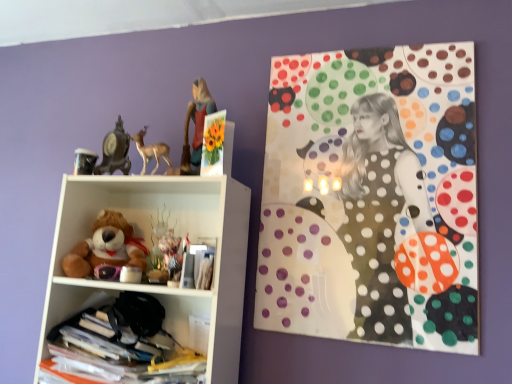
The width and height of the screenshot is (512, 384). What are the coordinates of `translucent glass vase at upper center, the 1th toy ordered from the bottom` in the screenshot? It's located at (170, 253).

This screenshot has width=512, height=384. Describe the element at coordinates (84, 161) in the screenshot. I see `matte black cup at upper left, placed as the third toy when sorted from right to left` at that location.

Describe the element at coordinates (115, 151) in the screenshot. I see `matte black clock at upper left, placed as the first toy when sorted from top to bottom` at that location.

I want to click on soft plush teddy bear at left, so click(x=106, y=250).

What do you see at coordinates (121, 332) in the screenshot? Image resolution: width=512 pixels, height=384 pixels. I see `translucent plastic folders at lower left, the second shelf when ordered from top to bottom` at bounding box center [121, 332].

This screenshot has width=512, height=384. Find the location of `matte plastic figurine of girl at upper center`. matte plastic figurine of girl at upper center is located at coordinates (196, 125).

Between point (197, 124) and point (80, 150), which one is positioned behind?

The point (80, 150) is farther from the camera.

Is matte plastic figurine of girl at upper center facing away from matte black cup at upper left, placed as the third toy when sorted from right to left?

No, matte black cup at upper left, placed as the third toy when sorted from right to left, is not at the back of matte plastic figurine of girl at upper center.

Is matte plastic figurine of girl at upper center directly adjacent to matte black cup at upper left, the 2th toy viewed from the top?

No, matte plastic figurine of girl at upper center is not next to matte black cup at upper left, the 2th toy viewed from the top.

How different are the orientations of matte plastic figurine of girl at upper center and matte black cup at upper left, which ranks as the 2th toy in bottom-to-top order, in degrees?

matte plastic figurine of girl at upper center and matte black cup at upper left, which ranks as the 2th toy in bottom-to-top order, are facing 20.7 degrees away from each other.

From a real-world perspective, is matte brown deer at upper left positioned under matte black cup at upper left, which ranks as the 2th toy in bottom-to-top order, based on gravity?

No.

Is matte brown deer at upper left in front of or behind matte black cup at upper left, which ranks as the 2th toy in bottom-to-top order, in the image?

In the image, matte brown deer at upper left appears in front of matte black cup at upper left, which ranks as the 2th toy in bottom-to-top order.

Considering the positions of point (143, 173) and point (75, 159), is point (143, 173) closer or farther from the camera than point (75, 159)?

Point (143, 173) is closer to the camera than point (75, 159).

Are matte brown deer at upper left and matte black cup at upper left, which ranks as the 2th toy in bottom-to-top order, located far from each other?

No.

What's the angular difference between matte brown deer at upper left and matte black clock at upper left, placed as the first toy when sorted from top to bottom,'s facing directions?

There is a 26.4-degree angle between the facing directions of matte brown deer at upper left and matte black clock at upper left, placed as the first toy when sorted from top to bottom.

Considering the points (147, 156) and (122, 152), which point is behind, point (147, 156) or point (122, 152)?

Positioned behind is point (122, 152).

Consider the image. From the image's perspective, is matte brown deer at upper left located beneath matte black clock at upper left, which is the 2th toy in left-to-right order?

Correct, matte brown deer at upper left appears lower than matte black clock at upper left, which is the 2th toy in left-to-right order, in the image.

Who is taller, matte black clock at upper left, the second toy when ordered from right to left, or matte black cup at upper left, placed as the third toy when sorted from right to left?

matte black clock at upper left, the second toy when ordered from right to left.

Is matte black clock at upper left, placed as the first toy when sorted from top to bottom, oriented towards matte black cup at upper left, placed as the 1th toy when sorted from left to right?

Yes.

From a real-world perspective, which object rests below the other?

matte black cup at upper left, the 2th toy viewed from the top, from a real-world perspective.

In the scene shown: Is matte black clock at upper left, placed as the first toy when sorted from top to bottom, to the right of matte black cup at upper left, which ranks as the 2th toy in bottom-to-top order, from the viewer's perspective?

Yes, matte black clock at upper left, placed as the first toy when sorted from top to bottom, is to the right of matte black cup at upper left, which ranks as the 2th toy in bottom-to-top order.

From the image's perspective, between translucent plastic folders at lower left, which is counted as the 1th shelf, starting from the bottom, and polka dot fabric at upper right, who is located below?

translucent plastic folders at lower left, which is counted as the 1th shelf, starting from the bottom, is shown below in the image.

Who is smaller, translucent plastic folders at lower left, which is counted as the 1th shelf, starting from the bottom, or polka dot fabric at upper right?

polka dot fabric at upper right is smaller.

From their relative heights in the image, would you say translucent plastic folders at lower left, which is counted as the 1th shelf, starting from the bottom, is taller or shorter than polka dot fabric at upper right?

In the image, translucent plastic folders at lower left, which is counted as the 1th shelf, starting from the bottom, appears to be shorter than polka dot fabric at upper right.

Is translucent plastic folders at lower left, which is counted as the 1th shelf, starting from the bottom, not within polka dot fabric at upper right?

That's correct, translucent plastic folders at lower left, which is counted as the 1th shelf, starting from the bottom, is outside of polka dot fabric at upper right.

Is matte plastic figurine of girl at upper center completely or partially outside of translucent glass vase at upper center, marked as the 1th toy in a right-to-left arrangement?

That's correct, matte plastic figurine of girl at upper center is outside of translucent glass vase at upper center, marked as the 1th toy in a right-to-left arrangement.

In the image, is matte plastic figurine of girl at upper center on the left side or the right side of translucent glass vase at upper center, the 1th toy ordered from the bottom?

Based on their positions, matte plastic figurine of girl at upper center is located to the right of translucent glass vase at upper center, the 1th toy ordered from the bottom.

Is matte plastic figurine of girl at upper center facing towards translucent glass vase at upper center, the 1th toy ordered from the bottom?

No.

Can you tell me how much matte plastic figurine of girl at upper center and translucent glass vase at upper center, which ranks as the 3th toy in left-to-right order, differ in facing direction?

The facing directions of matte plastic figurine of girl at upper center and translucent glass vase at upper center, which ranks as the 3th toy in left-to-right order, are 18.7 degrees apart.

Does point (396, 306) come behind point (149, 295)?

That is False.

Does polka dot fabric at upper right lie in front of translucent plastic folders at lower left, which is counted as the 1th shelf, starting from the bottom?

That is False.

Is polka dot fabric at upper right inside or outside of translucent plastic folders at lower left, which is counted as the 1th shelf, starting from the bottom?

polka dot fabric at upper right is outside translucent plastic folders at lower left, which is counted as the 1th shelf, starting from the bottom.

Is polka dot fabric at upper right in contact with translucent plastic folders at lower left, the second shelf when ordered from top to bottom?

No, polka dot fabric at upper right is not in contact with translucent plastic folders at lower left, the second shelf when ordered from top to bottom.

There is a matte plastic figurine of girl at upper center. Identify the location of the 2nd toy below it (from the image's perspective). Image resolution: width=512 pixels, height=384 pixels. (84, 161).

From the matte brown deer at upper left, count 2nd toys backward and point to it. Please provide its 2D coordinates.

[(84, 161)]

Which object lies nearer to the anchor point matte brown deer at upper left, matte black cup at upper left, the 2th toy viewed from the top, or translucent glass vase at upper center, the 1th toy ordered from the bottom?

matte black cup at upper left, the 2th toy viewed from the top, is positioned closer to the anchor matte brown deer at upper left.

Considering their positions, is polka dot fabric at upper right positioned further to white plastic shelf at left, acting as the 1th shelf starting from the top, than translucent plastic folders at lower left, which is counted as the 1th shelf, starting from the bottom?

polka dot fabric at upper right is positioned further to the anchor white plastic shelf at left, acting as the 1th shelf starting from the top.

Estimate the real-world distances between objects in this image. Which object is further from white plastic shelf at left, acting as the 1th shelf starting from the top, polka dot fabric at upper right or translucent glass vase at upper center, the 3th toy when ordered from top to bottom?

polka dot fabric at upper right is positioned further to the anchor white plastic shelf at left, acting as the 1th shelf starting from the top.

Which object lies nearer to the anchor point translucent plastic folders at lower left, which is counted as the 1th shelf, starting from the bottom, matte black cup at upper left, the 2th toy viewed from the top, or polka dot fabric at upper right?

Among the two, matte black cup at upper left, the 2th toy viewed from the top, is located nearer to translucent plastic folders at lower left, which is counted as the 1th shelf, starting from the bottom.

Considering their positions, is translucent plastic folders at lower left, the second shelf when ordered from top to bottom, positioned closer to matte plastic figurine of girl at upper center than matte black cup at upper left, placed as the 1th toy when sorted from left to right?

Based on the image, matte black cup at upper left, placed as the 1th toy when sorted from left to right, appears to be nearer to matte plastic figurine of girl at upper center.

Considering their positions, is matte plastic figurine of girl at upper center positioned further to translucent glass vase at upper center, marked as the 1th toy in a right-to-left arrangement, than matte brown deer at upper left?

matte plastic figurine of girl at upper center is positioned further to the anchor translucent glass vase at upper center, marked as the 1th toy in a right-to-left arrangement.

Considering their positions, is matte brown deer at upper left positioned further to white plastic shelf at left, acting as the 1th shelf starting from the top, than matte black cup at upper left, placed as the third toy when sorted from right to left?

matte black cup at upper left, placed as the third toy when sorted from right to left, is positioned further to the anchor white plastic shelf at left, acting as the 1th shelf starting from the top.

Which object lies nearer to the anchor point matte black cup at upper left, placed as the 1th toy when sorted from left to right, white plastic shelf at left, acting as the 1th shelf starting from the top, or translucent plastic folders at lower left, the second shelf when ordered from top to bottom?

Among the two, white plastic shelf at left, acting as the 1th shelf starting from the top, is located nearer to matte black cup at upper left, placed as the 1th toy when sorted from left to right.

This screenshot has width=512, height=384. Identify the location of teddy bear between matte plastic figurine of girl at upper center and white plastic shelf at left, the 2th shelf in the bottom-to-top sequence, in the vertical direction. (106, 250).

Locate an element on the screen. The width and height of the screenshot is (512, 384). animal between white plastic shelf at left, acting as the 1th shelf starting from the top, and polka dot fabric at upper right, in the horizontal direction is located at coordinates (151, 151).

Locate an element on the screen. This screenshot has width=512, height=384. toy that lies between matte brown deer at upper left and soft plush teddy bear at left from top to bottom is located at coordinates (84, 161).

Locate an element on the screen. The width and height of the screenshot is (512, 384). teddy bear located between matte black cup at upper left, which ranks as the 2th toy in bottom-to-top order, and polka dot fabric at upper right in the left-right direction is located at coordinates (106, 250).